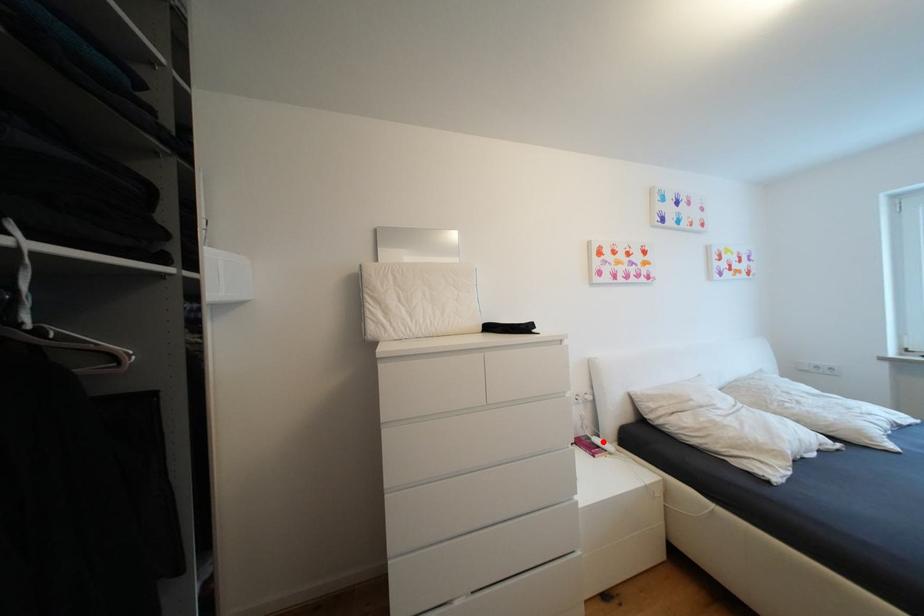
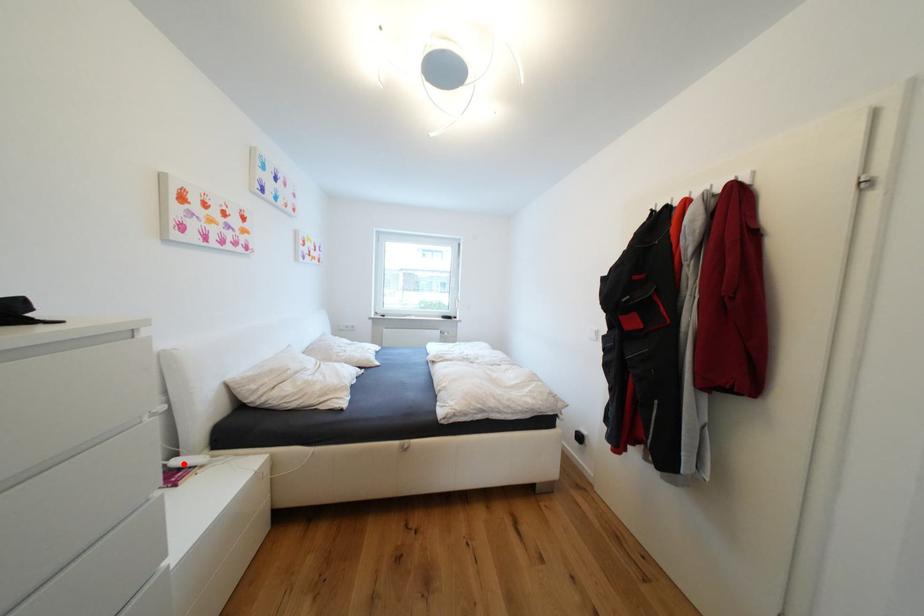
Consider the image. I am providing you with two images of the same scene from different viewpoints. A red point is marked on the first image and another point is marked on the second image. Are the points marked in image1 and image2 representing the same 3D position?

Yes